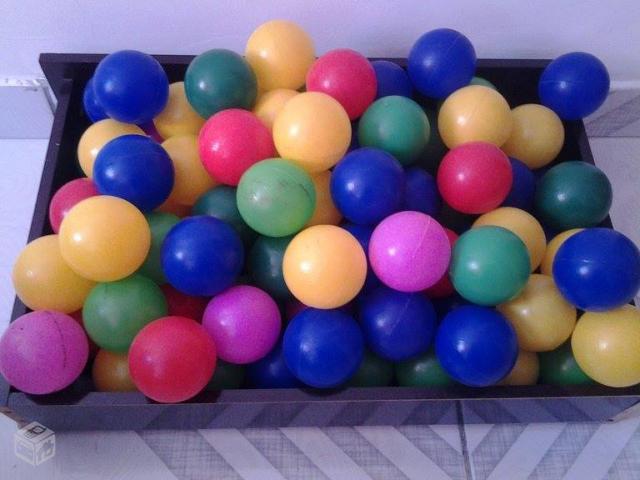
This screenshot has height=480, width=640. Find the location of `wall cover`. wall cover is located at coordinates (15, 103).